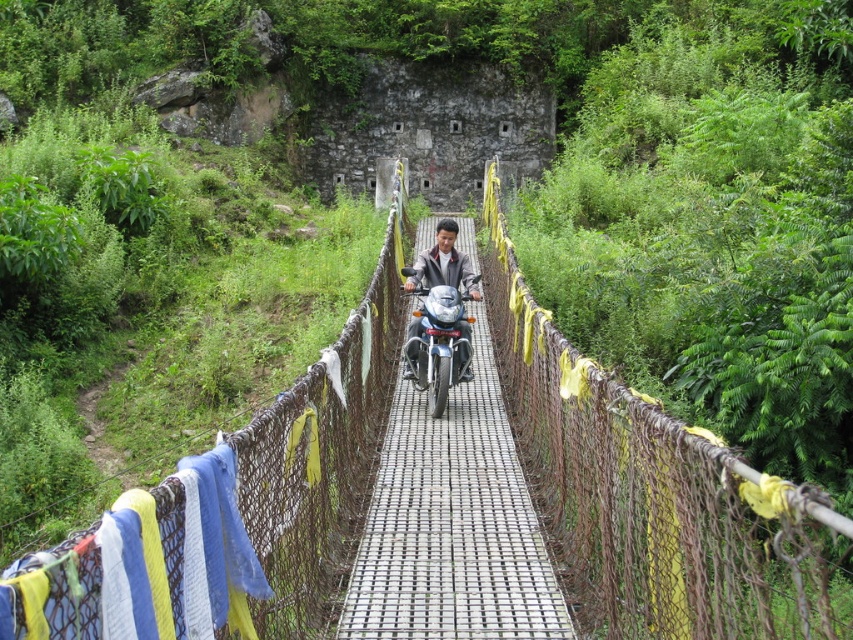
Does point (207, 616) come behind point (409, 330)?

No, (207, 616) is in front of (409, 330).

Can you confirm if blue woven cloth at left is taller than matte black motorcycle at center?

In fact, blue woven cloth at left may be shorter than matte black motorcycle at center.

Which is in front, point (207, 461) or point (461, 328)?

Point (207, 461) is more forward.

Locate an element on the screen. blue woven cloth at left is located at coordinates (216, 548).